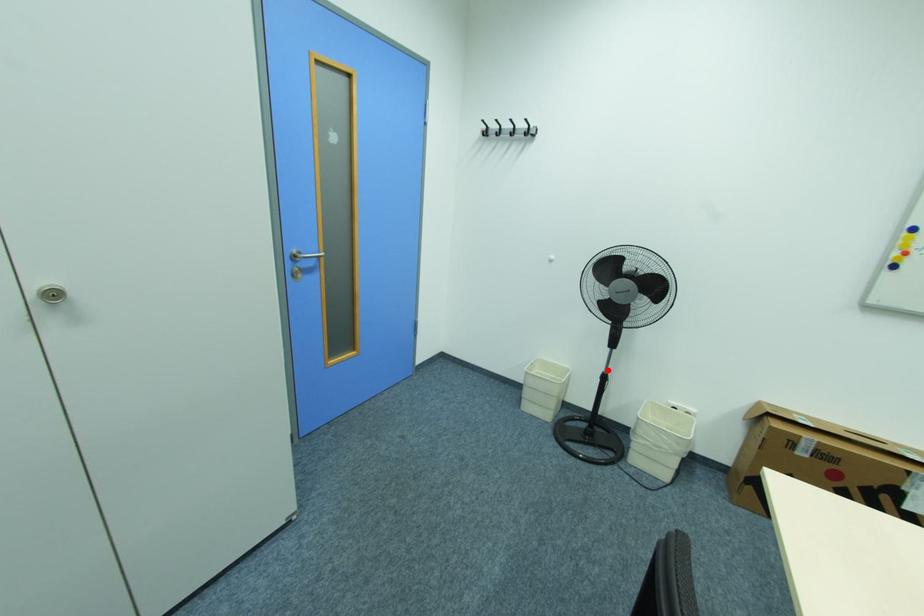
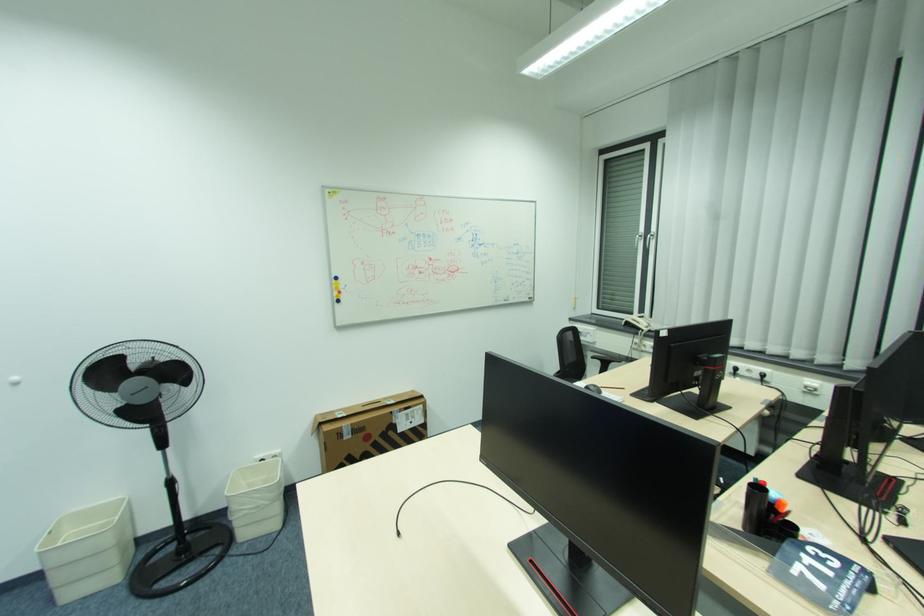
Question: I am providing you with two images of the same scene from different viewpoints. In image1, a red point is highlighted. Considering the same 3D point in image2, which of the following is correct?

Choices:
 (A) It is closer
 (B) It is farther

Answer: (B)